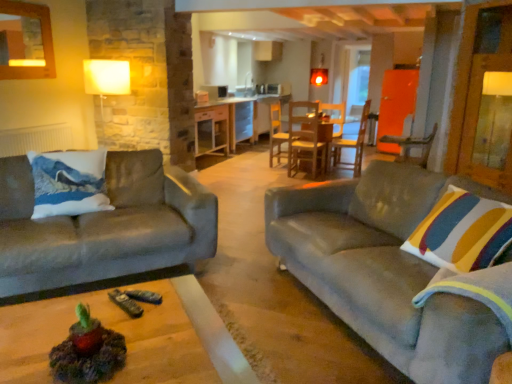
Question: Is transparent glass door at center spatially inside wooden chair at center, which is counted as the 1th chair, starting from the left, or outside of it?

Choices:
 (A) inside
 (B) outside

Answer: (B)

Question: In terms of height, does transparent glass door at center look taller or shorter compared to wooden chair at center, placed as the first chair when sorted from back to front?

Choices:
 (A) short
 (B) tall

Answer: (B)

Question: Estimate the real-world distances between objects in this image. Which object is closer to the wooden chair at right, marked as the second chair in a left-to-right arrangement?

Choices:
 (A) transparent glass door at center
 (B) velvet grey couch at right, which ranks as the 2th studio couch in left-to-right order
 (C) wooden chair at center, arranged as the 2th chair when viewed from the right
 (D) velvet gray couch at left, the 1th studio couch when ordered from left to right
 (E) white matte radiator at left

Answer: (B)

Question: Which object is the farthest from the wooden table at center?

Choices:
 (A) velvet grey couch at right, acting as the 1th studio couch starting from the right
 (B) wooden chair at right, acting as the 1th chair starting from the right
 (C) white matte radiator at left
 (D) wooden chair at center, placed as the first chair when sorted from back to front
 (E) velvet gray couch at left, arranged as the 2th studio couch when viewed from the right

Answer: (A)